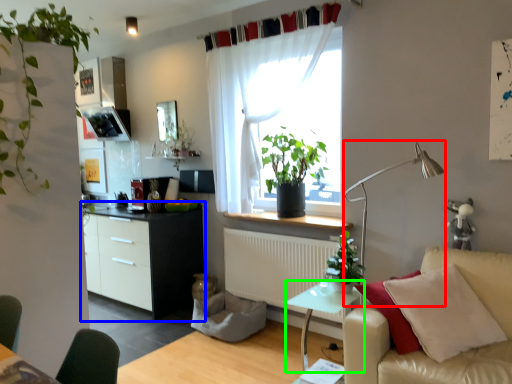
Question: Which is farther away from table lamp (highlighted by a red box)? cabinetry (highlighted by a blue box) or table (highlighted by a green box)?

Choices:
 (A) cabinetry
 (B) table

Answer: (A)